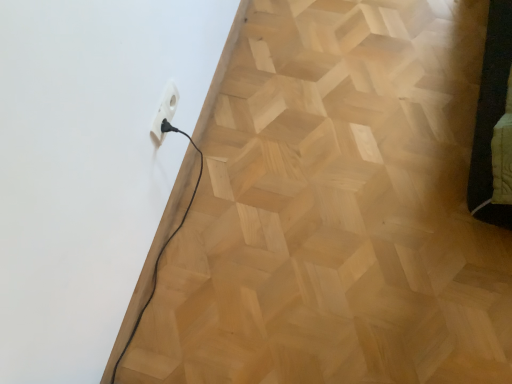
Measure the distance between white plastic socket at upper left and camera.

3.43 feet.

The width and height of the screenshot is (512, 384). Identify the location of white plastic socket at upper left. pos(165,110).

Image resolution: width=512 pixels, height=384 pixels. What do you see at coordinates (165, 110) in the screenshot?
I see `white plastic socket at upper left` at bounding box center [165, 110].

I want to click on white plastic socket at upper left, so click(165, 110).